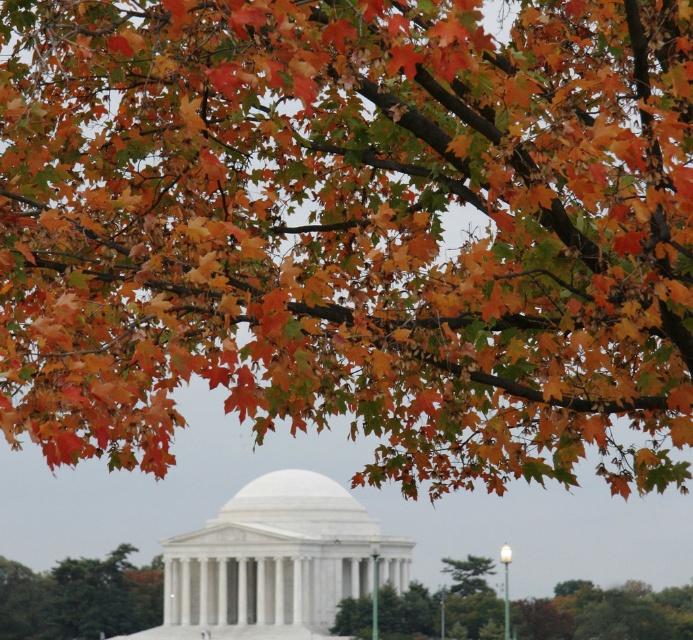
Question: Among these objects, which one is farthest from the camera?

Choices:
 (A) white marble gazebo at center
 (B) green matte tree at lower left
 (C) green leafy tree at center

Answer: (B)

Question: Does white marble gazebo at center have a greater width compared to green leafy tree at center?

Choices:
 (A) no
 (B) yes

Answer: (A)

Question: Based on their relative distances, which object is farther from the green matte tree at lower left?

Choices:
 (A) white marble gazebo at center
 (B) green leafy tree at center

Answer: (B)

Question: Which point is closer to the camera?

Choices:
 (A) white marble gazebo at center
 (B) green leafy tree at center

Answer: (A)

Question: Does white marble gazebo at center have a smaller size compared to green matte tree at lower left?

Choices:
 (A) yes
 (B) no

Answer: (B)

Question: Does white marble gazebo at center appear under green leafy tree at center?

Choices:
 (A) yes
 (B) no

Answer: (B)